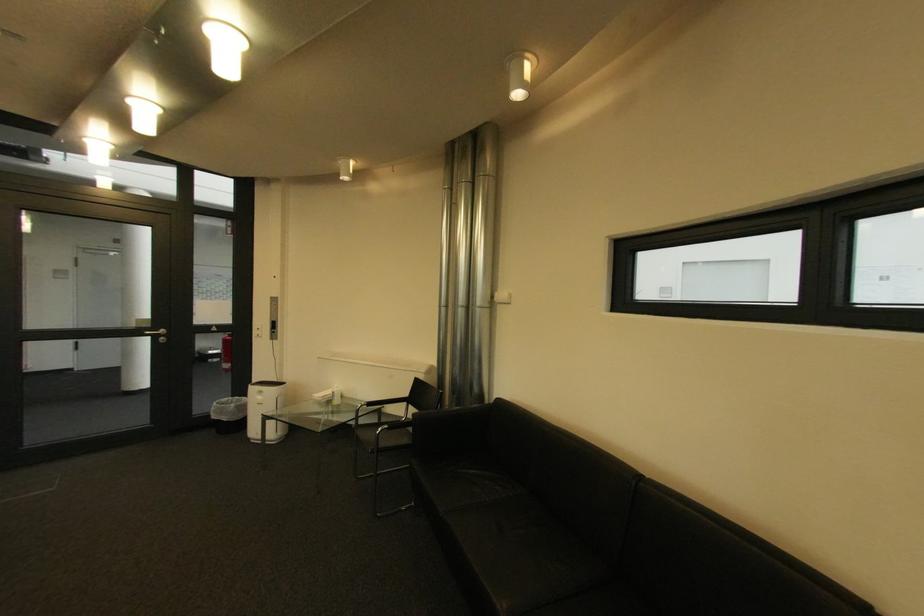
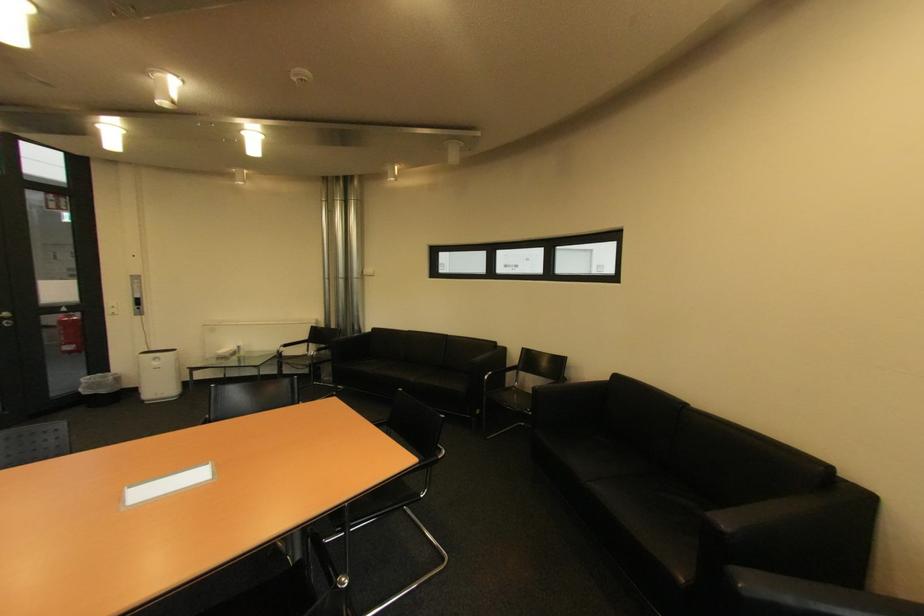
Find the pixel in the second image that matches (235,367) in the first image.

(79, 349)